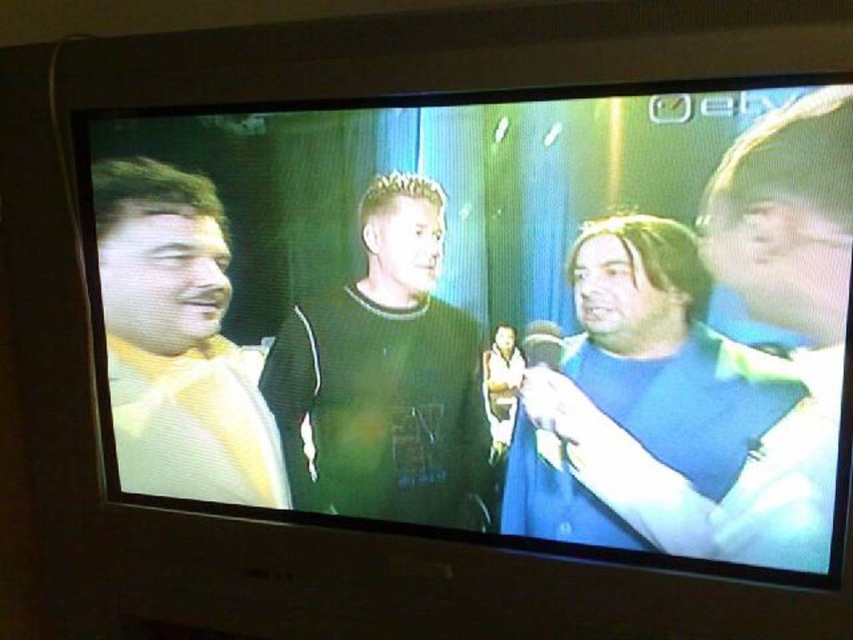
Who is more distant from viewer, (792, 376) or (329, 468)?

The point (329, 468) is behind.

Can you confirm if blue matte shirt at right is positioned to the right of dark green sweater at center?

Indeed, blue matte shirt at right is positioned on the right side of dark green sweater at center.

Locate an element on the screen. The image size is (853, 640). blue matte shirt at right is located at coordinates [728, 344].

Is matte black shirt at center positioned before yellow fabric shirt at left?

Yes, matte black shirt at center is closer to the viewer.

Can you confirm if matte black shirt at center is bigger than yellow fabric shirt at left?

Yes, matte black shirt at center is bigger than yellow fabric shirt at left.

Identify the location of matte black shirt at center. (486, 316).

Where is `matte black shirt at center`? This screenshot has height=640, width=853. matte black shirt at center is located at coordinates (486, 316).

Who is more distant from viewer, (366, 257) or (664, 461)?

Positioned behind is point (366, 257).

Locate an element on the screen. The height and width of the screenshot is (640, 853). matte black shirt at center is located at coordinates (486, 316).